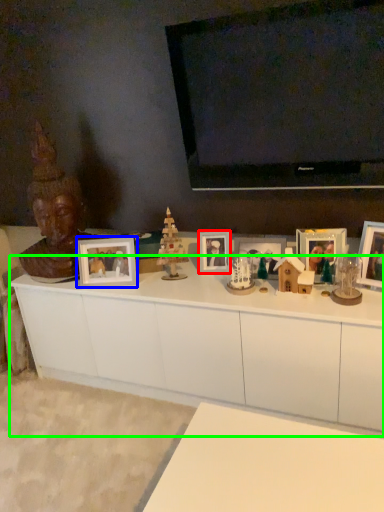
Question: Based on their relative distances, which object is nearer to picture frame (highlighted by a red box)? Choose from picture frame (highlighted by a blue box) and cabinetry (highlighted by a green box).

Choices:
 (A) picture frame
 (B) cabinetry

Answer: (A)